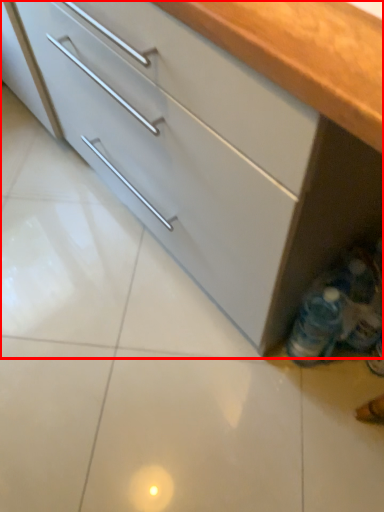
Question: From the image's perspective, what is the correct spatial relationship of cabinetry (annotated by the red box) in relation to bottle?

Choices:
 (A) below
 (B) above

Answer: (B)